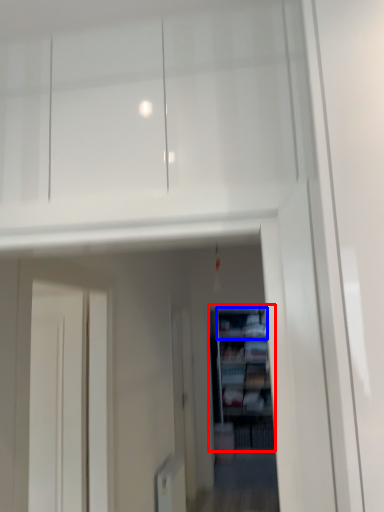
Question: Which point is closer to the camera, shelf (highlighted by a red box) or cabinet (highlighted by a blue box)?

Choices:
 (A) shelf
 (B) cabinet

Answer: (A)